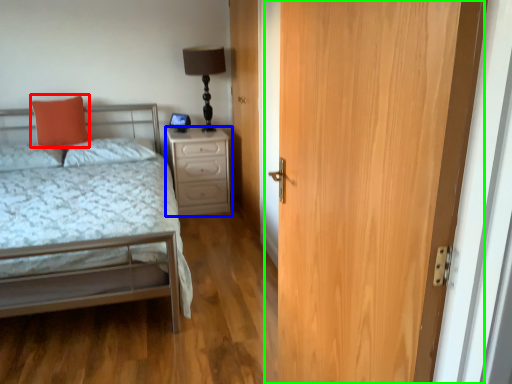
Question: Considering the real-world distances, which object is closest to pillow (highlighted by a red box)? nightstand (highlighted by a blue box) or door (highlighted by a green box).

Choices:
 (A) nightstand
 (B) door

Answer: (A)